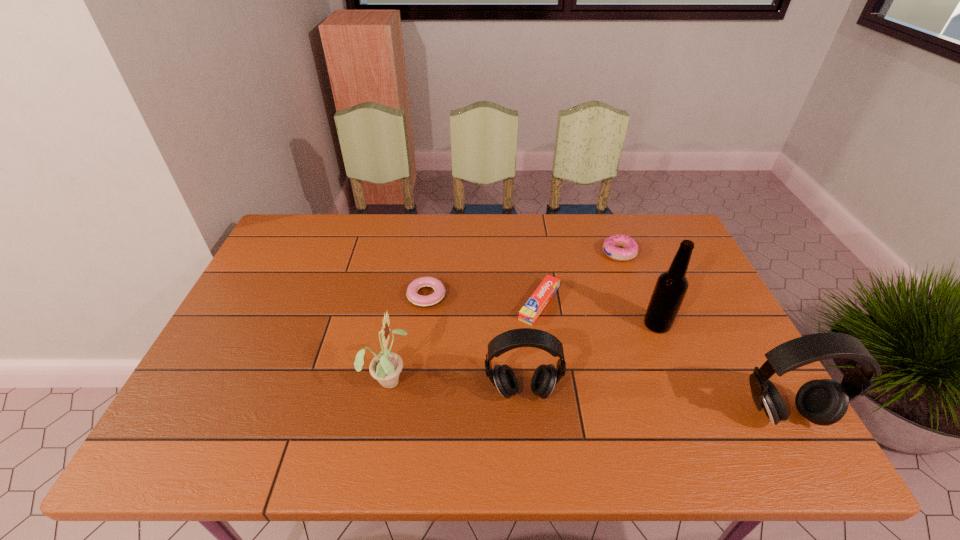
In the image, there is a desktop. Where is `free space at the far edge`? The image size is (960, 540). free space at the far edge is located at coordinates (516, 252).

Identify the location of blank area at the near edge. This screenshot has height=540, width=960. pos(353,397).

Find the location of a particular element. The image size is (960, 540). free space at the left edge of the desktop is located at coordinates (252, 356).

Where is `free space at the right edge of the desktop`? This screenshot has height=540, width=960. free space at the right edge of the desktop is located at coordinates (693, 266).

The image size is (960, 540). What are the coordinates of `vacant area at the far left corner` in the screenshot? It's located at (333, 224).

You are a GUI agent. You are given a task and a screenshot of the screen. Output one action in this format:
    pyautogui.click(x=<x>, y=<y>)
    Task: Click on the vacant point at the near left corner
    This screenshot has height=540, width=960.
    Given the screenshot: What is the action you would take?
    pyautogui.click(x=243, y=410)

Where is `vacant space at the far right corner`? Image resolution: width=960 pixels, height=540 pixels. vacant space at the far right corner is located at coordinates (676, 226).

You are a GUI agent. You are given a task and a screenshot of the screen. Output one action in this format:
    pyautogui.click(x=<x>, y=<y>)
    Task: Click on the free spot between the nearer doughnut and the sunflower
    This screenshot has width=960, height=540.
    Given the screenshot: What is the action you would take?
    pyautogui.click(x=407, y=338)

The width and height of the screenshot is (960, 540). I want to click on free point between the taller earphone and the sunflower, so click(586, 397).

Locate an element on the screen. free point between the sunflower and the farthest object is located at coordinates [504, 316].